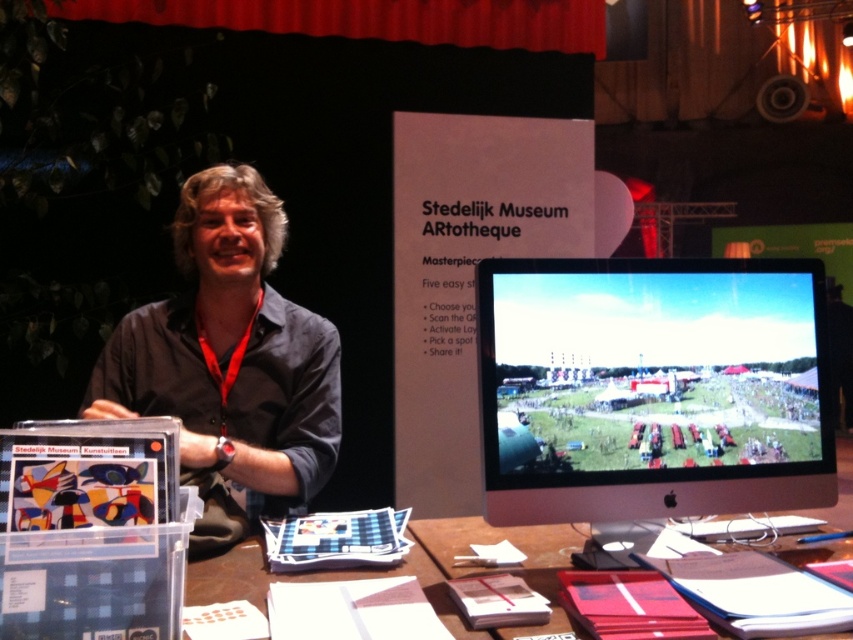
You are a visitor at the Stedelijk Museum ARtotheque event and see the dark blue shirt at center and the brown paper at center on the table. Which item is closer to the top of the table?

The dark blue shirt at center is located above the brown paper at center, so it is closer to the top of the table.

You are a visitor at the Stedelijk Museum ARtotheque event. You see a satin black monitor at center and a dark blue shirt at center. How far apart are these two items from each other?

The distance between the satin black monitor at center and the dark blue shirt at center is 25.43 inches.

You are an event attendee at the Stedelijk Museum ARtotheque. You see a table with a satin black monitor at center and a brown paper at center. Which object on the table takes up more space?

The satin black monitor at center is larger in size than the brown paper at center, so the satin black monitor at center takes up more space.